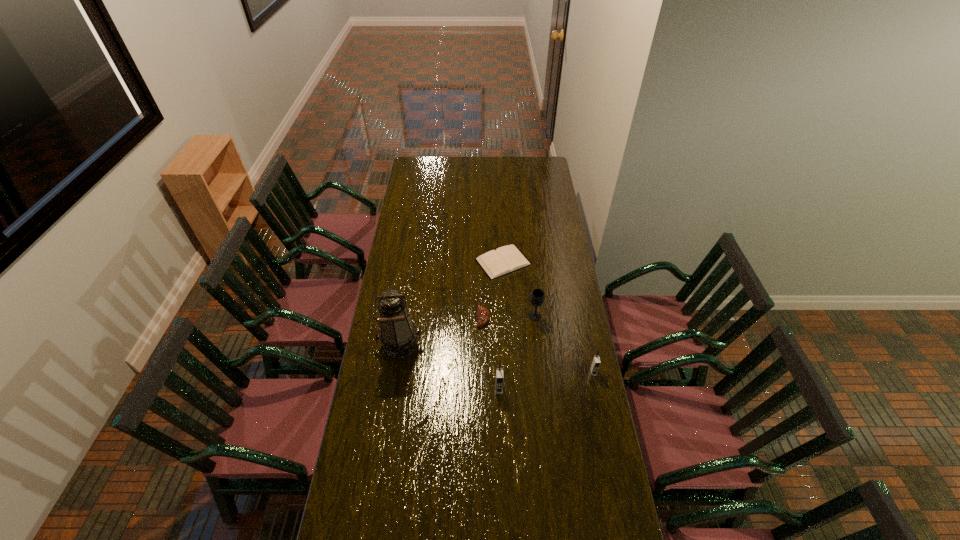
This screenshot has height=540, width=960. I want to click on the second tallest object, so click(499, 371).

Identify the location of the taller cellular telephone. (499, 371).

The image size is (960, 540). Find the location of `the second nearest object`. the second nearest object is located at coordinates (595, 364).

Locate an element on the screen. The width and height of the screenshot is (960, 540). the rightmost object is located at coordinates (595, 364).

Image resolution: width=960 pixels, height=540 pixels. What are the coordinates of `wineglass` in the screenshot? It's located at (537, 297).

What are the coordinates of `the farthest object` in the screenshot? It's located at (506, 259).

You are a GUI agent. You are given a task and a screenshot of the screen. Output one action in this format:
    pyautogui.click(x=<x>, y=<y>)
    Task: Click on the hardback book
    The image size is (960, 540).
    Given the screenshot: What is the action you would take?
    pyautogui.click(x=506, y=259)

The height and width of the screenshot is (540, 960). Identify the location of the fourth farthest object. (398, 334).

At what (x,y) coordinates should I click in order to perform the action: click on the leftmost object. Please return your answer as a coordinate pair (x, y). Image resolution: width=960 pixels, height=540 pixels. Looking at the image, I should click on (398, 334).

The height and width of the screenshot is (540, 960). Find the location of `the second shortest object`. the second shortest object is located at coordinates (483, 315).